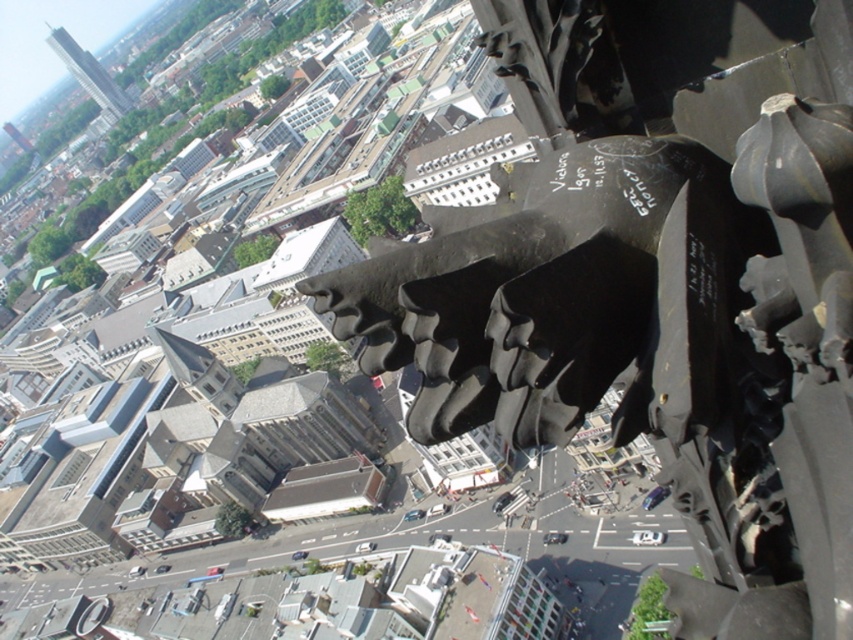
Where is `black stone gargoyle at upper center`? The height and width of the screenshot is (640, 853). black stone gargoyle at upper center is located at coordinates (659, 282).

Between point (848, 400) and point (62, 45), which one is positioned behind?

Point (62, 45)

The height and width of the screenshot is (640, 853). What are the coordinates of `black stone gargoyle at upper center` in the screenshot? It's located at (659, 282).